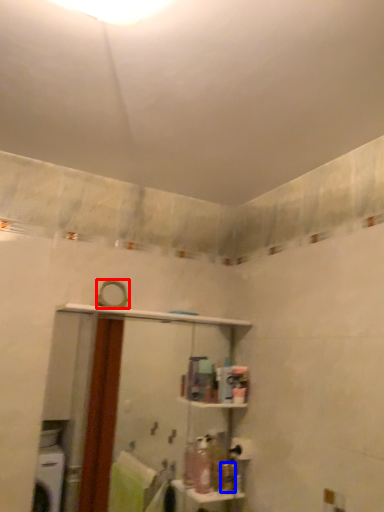
Question: Which object is closer to the camera taking this photo, mirror (highlighted by a red box) or toiletry (highlighted by a blue box)?

Choices:
 (A) mirror
 (B) toiletry

Answer: (A)